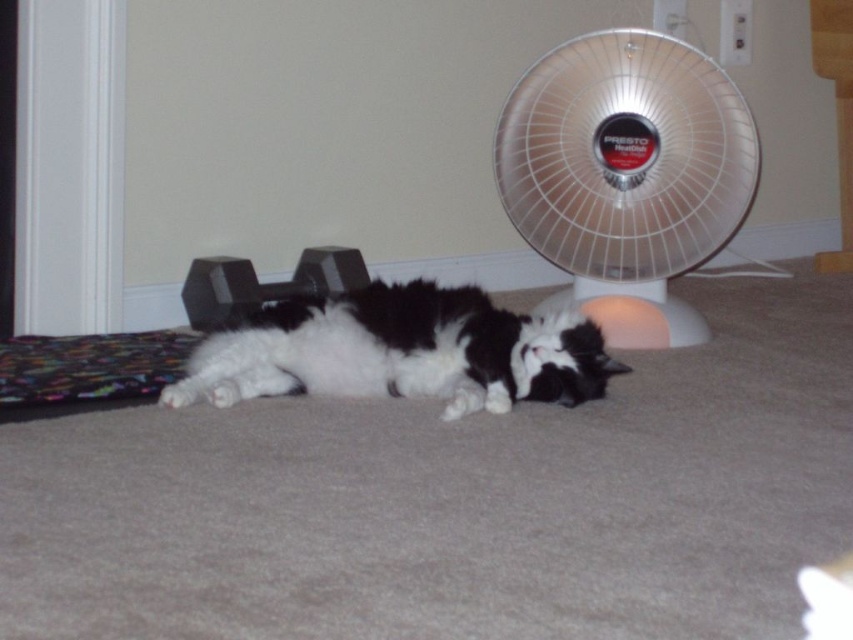
Question: Can you confirm if fluffy white cat at center is positioned to the right of black rubber dumbbell at center?

Choices:
 (A) no
 (B) yes

Answer: (B)

Question: Can you confirm if white plastic fan at center is positioned to the right of black rubber dumbbell at center?

Choices:
 (A) yes
 (B) no

Answer: (A)

Question: Which point is farther to the camera?

Choices:
 (A) (395, 380)
 (B) (637, 150)
 (C) (206, 300)

Answer: (C)

Question: Does white plastic fan at center have a greater width compared to fluffy white cat at center?

Choices:
 (A) yes
 (B) no

Answer: (B)

Question: Which point appears farthest from the camera in this image?

Choices:
 (A) (564, 401)
 (B) (677, 72)
 (C) (312, 276)

Answer: (C)

Question: Which of the following is the closest to the observer?

Choices:
 (A) (250, 284)
 (B) (701, 220)
 (C) (451, 413)

Answer: (C)